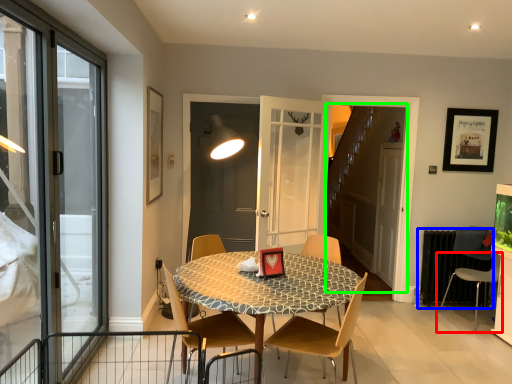
Question: Which is farther away from chair (highlighted by a red box)? radiator (highlighted by a blue box) or elevator (highlighted by a green box)?

Choices:
 (A) radiator
 (B) elevator

Answer: (B)